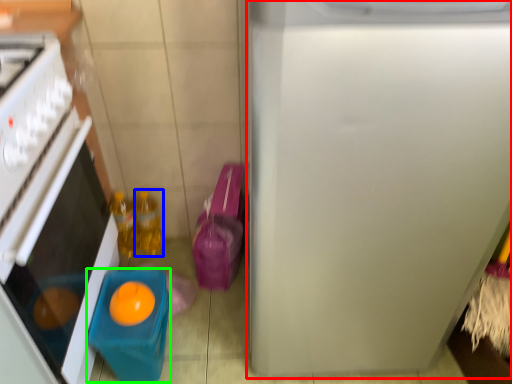
Question: Considering the real-world distances, which object is closest to refrigerator (highlighted by a red box)? bottle (highlighted by a blue box) or toy (highlighted by a green box).

Choices:
 (A) bottle
 (B) toy

Answer: (B)